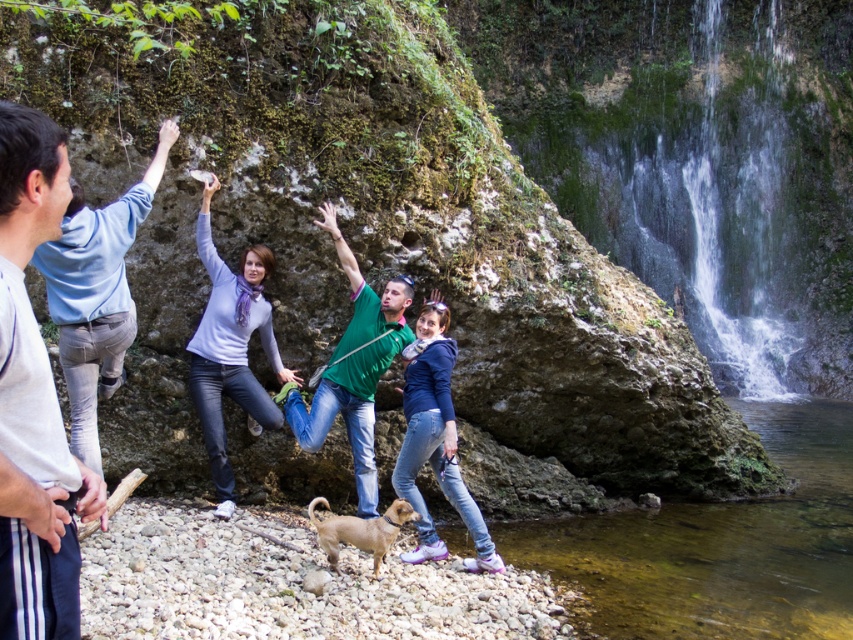
You are standing at point A which is at coordinates point (221, 362). You want to walk to point B at coordinates point (407, 420). Which direction should you move relative to your current position?

Since point (221, 362) is behind point (407, 420), you should move forward to reach point B from point A.